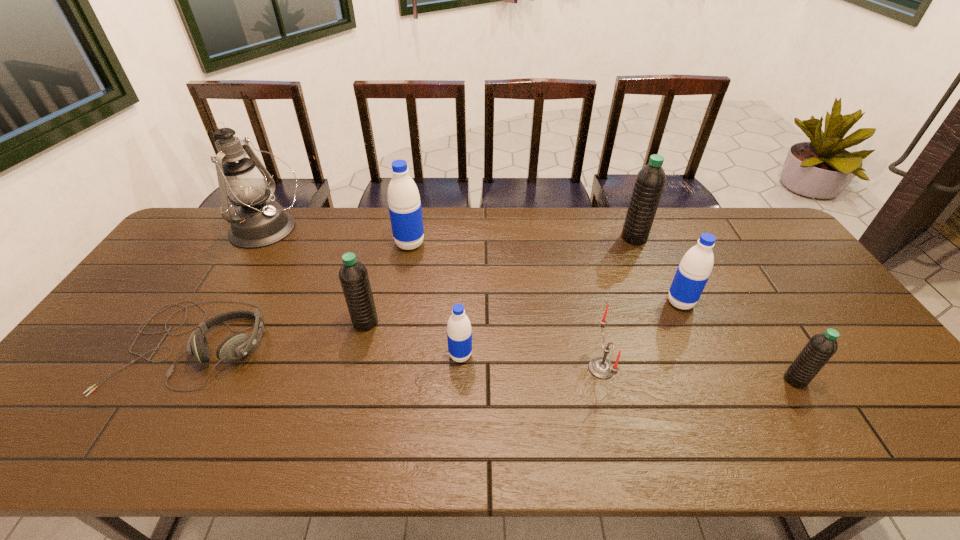
Locate which blue water bottle is the closest to the leftmost blue water bottle. Please provide its 2D coordinates. Your answer should be formatted as a tuple, i.e. [(x, y)], where the tuple contains the x and y coordinates of a point satisfying the conditions above.

[(459, 334)]

Image resolution: width=960 pixels, height=540 pixels. I want to click on black water bottle that is the closest to the nearest blue water bottle, so click(x=353, y=275).

Identify which black water bottle is located as the second nearest to the second nearest blue water bottle. Please provide its 2D coordinates. Your answer should be formatted as a tuple, i.e. [(x, y)], where the tuple contains the x and y coordinates of a point satisfying the conditions above.

[(821, 347)]

Image resolution: width=960 pixels, height=540 pixels. I want to click on free spot that satisfies the following two spatial constraints: 1. on the outer surface of the nearest blue water bottle; 2. on the right side of the shortest object, so click(188, 355).